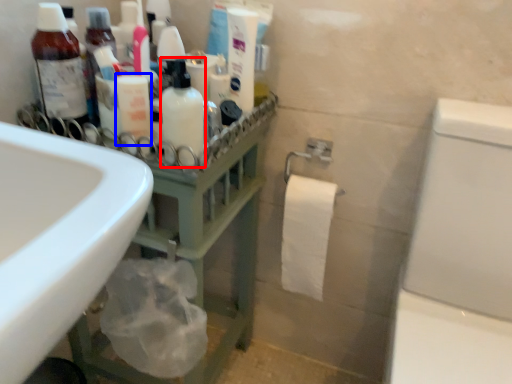
Question: Which of the following is the closest to the observer, mouthwash (highlighted by a red box) or toiletry (highlighted by a blue box)?

Choices:
 (A) mouthwash
 (B) toiletry

Answer: (A)